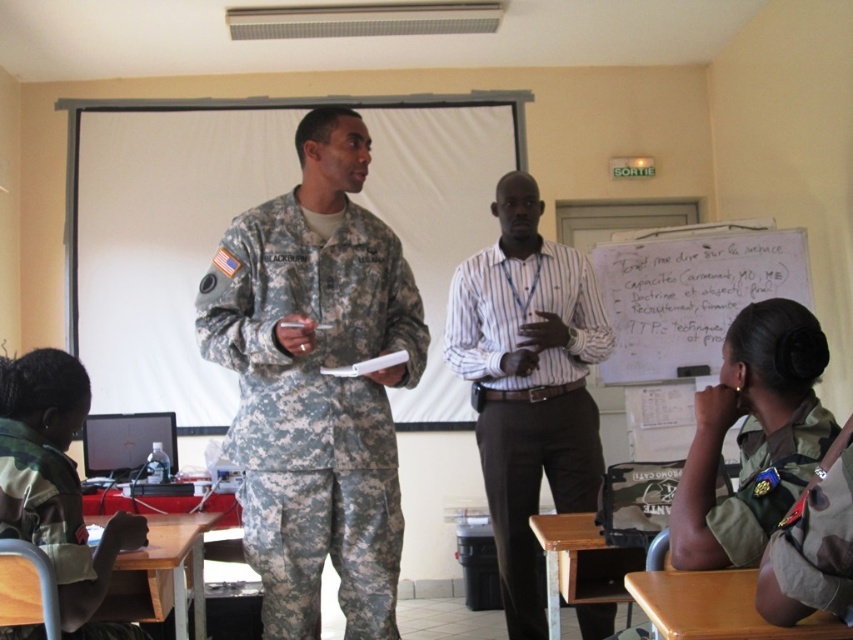
Between point (283, 557) and point (48, 362), which one is positioned behind?

Positioned behind is point (283, 557).

You are a GUI agent. You are given a task and a screenshot of the screen. Output one action in this format:
    pyautogui.click(x=<x>, y=<y>)
    Task: Click on the camouflage uniform at center
    The height and width of the screenshot is (640, 853).
    Given the screenshot: What is the action you would take?
    pyautogui.click(x=316, y=381)

Does point (370, 612) lie behind point (747, 440)?

Yes.

Can you confirm if camouflage uniform at center is positioned below camouflage fabric uniform at lower right?

Incorrect, camouflage uniform at center is not positioned below camouflage fabric uniform at lower right.

Does point (259, 371) lie behind point (741, 522)?

Yes, it is behind point (741, 522).

What are the coordinates of `camouflage uniform at center` in the screenshot? It's located at (316, 381).

Which is above, whiteboard at right or camouflage fabric uniform at lower right?

whiteboard at right

Can you confirm if whiteboard at right is positioned to the right of camouflage fabric uniform at lower right?

Indeed, whiteboard at right is positioned on the right side of camouflage fabric uniform at lower right.

Is point (664, 291) positioned in front of point (743, 422)?

No, it is behind (743, 422).

Where is `whiteboard at right`? whiteboard at right is located at coordinates (689, 296).